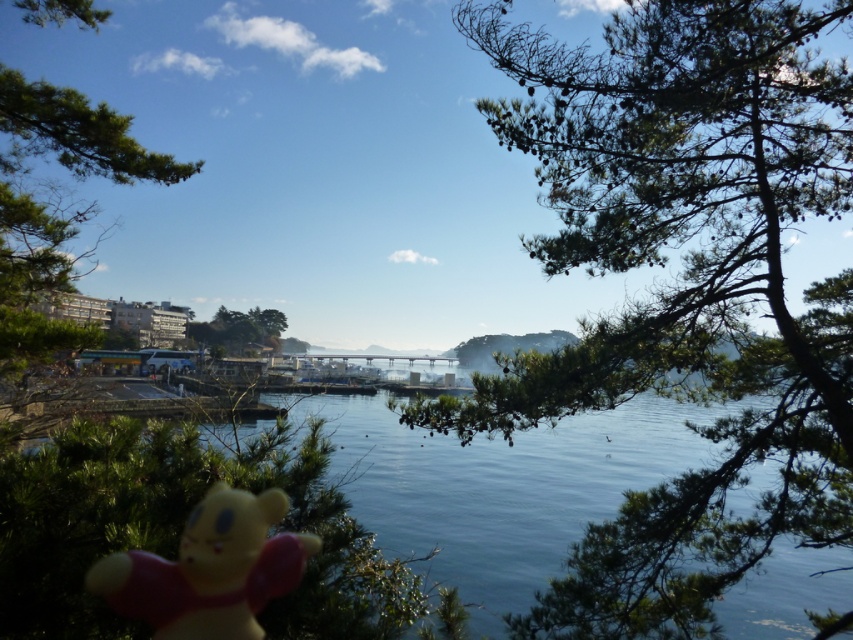
Looking at this image, can you confirm if yellow matte plush bear at lower left is positioned to the right of green matte tree at center?

Indeed, yellow matte plush bear at lower left is positioned on the right side of green matte tree at center.

Does yellow matte plush bear at lower left have a lesser width compared to green matte tree at center?

Yes.

Identify the location of yellow matte plush bear at lower left. The image size is (853, 640). (210, 570).

Can you confirm if green needle-like leaves at upper center is thinner than yellow matte plush bear at lower left?

No.

Does green needle-like leaves at upper center appear under yellow matte plush bear at lower left?

No.

Measure the distance between green needle-like leaves at upper center and camera.

green needle-like leaves at upper center and camera are 5.14 meters apart from each other.

Locate an element on the screen. green needle-like leaves at upper center is located at coordinates (682, 285).

Measure the distance between green needle-like leaves at upper center and camera.

They are 16.86 feet apart.

Is point (589, 100) in front of point (90, 20)?

Yes, it is.

Does point (831, 280) come behind point (4, 308)?

Yes, point (831, 280) is farther from viewer.

Locate an element on the screen. green needle-like leaves at upper center is located at coordinates (682, 285).